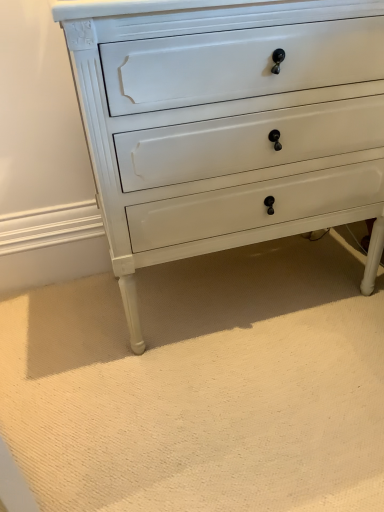
The width and height of the screenshot is (384, 512). Describe the element at coordinates (228, 124) in the screenshot. I see `white painted wood chest of drawers at center` at that location.

Locate an element on the screen. The height and width of the screenshot is (512, 384). white painted wood chest of drawers at center is located at coordinates (228, 124).

Locate an element on the screen. Image resolution: width=384 pixels, height=512 pixels. white painted wood chest of drawers at center is located at coordinates 228,124.